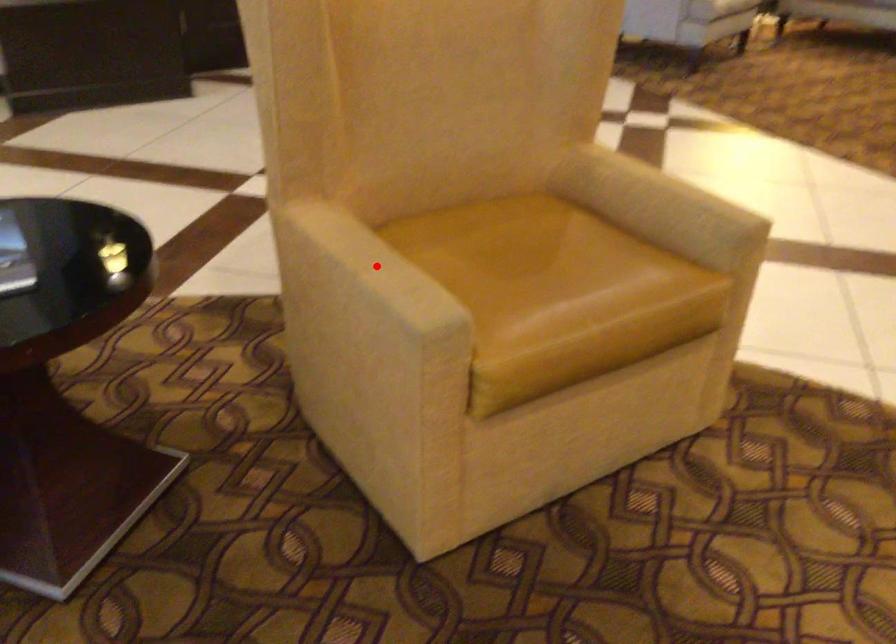
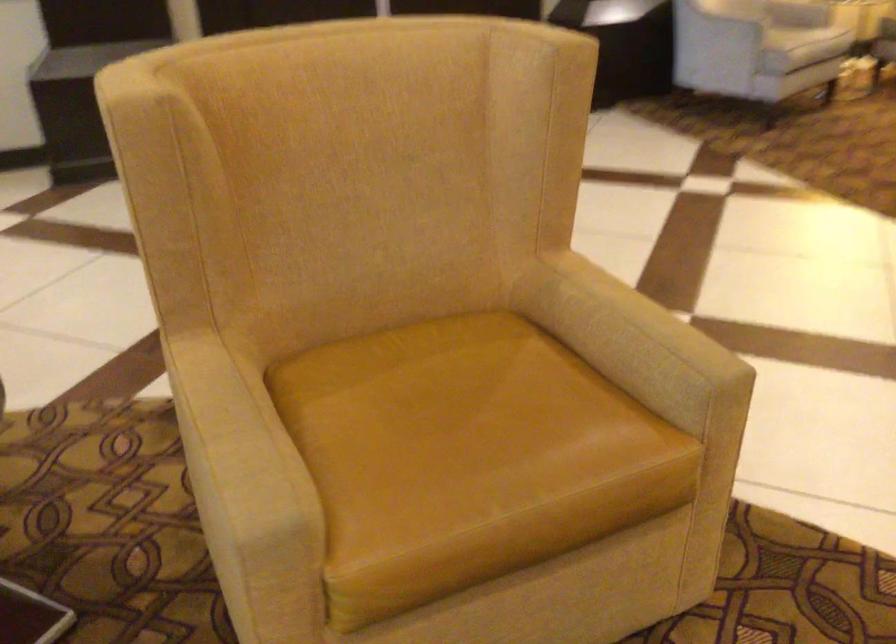
The point at the highlighted location is marked in the first image. Where is the corresponding point in the second image?

(235, 435)